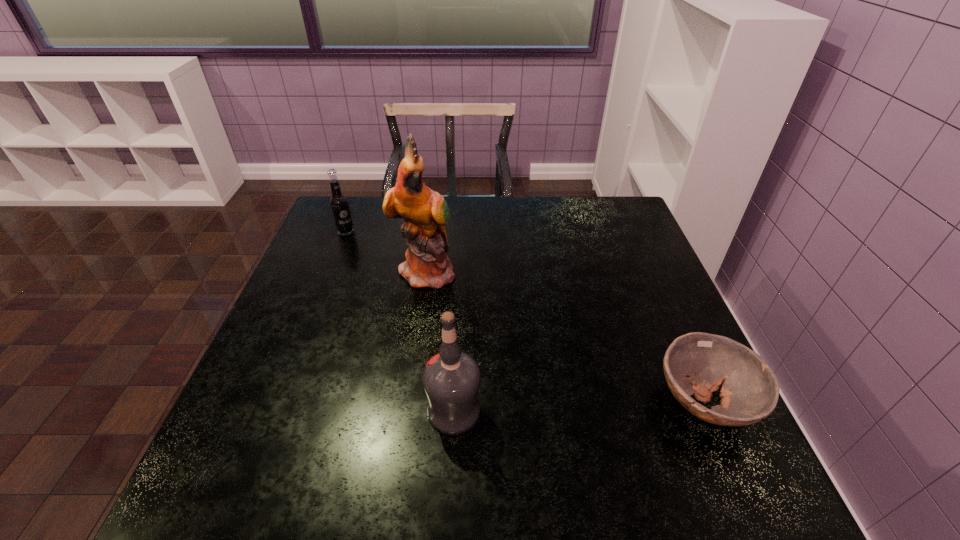
Locate an element on the screen. vodka is located at coordinates (451, 379).

What are the coordinates of `bowl` in the screenshot? It's located at (697, 363).

Where is `the shortest object`? This screenshot has height=540, width=960. the shortest object is located at coordinates (697, 363).

Image resolution: width=960 pixels, height=540 pixels. I want to click on the tallest object, so pos(425,212).

Identify the location of the third nearest object. The height and width of the screenshot is (540, 960). (425, 212).

I want to click on the leftmost object, so click(x=339, y=204).

The width and height of the screenshot is (960, 540). I want to click on the second shortest object, so click(339, 204).

Locate an element on the screen. The height and width of the screenshot is (540, 960). vacant area located on the front label of the vodka is located at coordinates (339, 411).

Where is `vacant area situated 0.130m on the front label of the vodka`? vacant area situated 0.130m on the front label of the vodka is located at coordinates (360, 411).

Identify the location of vacant region located 0.330m on the front label of the vodka. (256, 411).